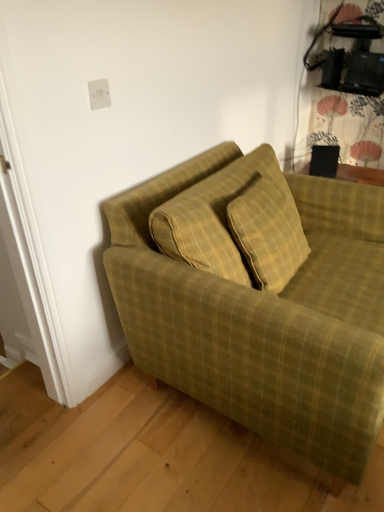
Question: Can you confirm if white plastic outlet at upper center is taller than green plaid fabric couch at lower right?

Choices:
 (A) no
 (B) yes

Answer: (A)

Question: Is white plastic outlet at upper center facing towards green plaid fabric couch at lower right?

Choices:
 (A) no
 (B) yes

Answer: (A)

Question: From a real-world perspective, is white plastic outlet at upper center positioned under green plaid fabric couch at lower right based on gravity?

Choices:
 (A) yes
 (B) no

Answer: (B)

Question: Considering the relative sizes of white plastic outlet at upper center and green plaid fabric couch at lower right in the image provided, is white plastic outlet at upper center shorter than green plaid fabric couch at lower right?

Choices:
 (A) no
 (B) yes

Answer: (B)

Question: Does white plastic outlet at upper center appear on the right side of green plaid fabric couch at lower right?

Choices:
 (A) no
 (B) yes

Answer: (A)

Question: Is white plastic outlet at upper center oriented away from green plaid fabric couch at lower right?

Choices:
 (A) yes
 (B) no

Answer: (B)

Question: Considering the relative sizes of green plaid fabric couch at lower right and white plastic outlet at upper center in the image provided, is green plaid fabric couch at lower right bigger than white plastic outlet at upper center?

Choices:
 (A) yes
 (B) no

Answer: (A)

Question: Would you consider green plaid fabric couch at lower right to be distant from white plastic outlet at upper center?

Choices:
 (A) yes
 (B) no

Answer: (B)

Question: Does green plaid fabric couch at lower right come in front of white plastic outlet at upper center?

Choices:
 (A) no
 (B) yes

Answer: (B)

Question: From a real-world perspective, does green plaid fabric couch at lower right stand above white plastic outlet at upper center?

Choices:
 (A) no
 (B) yes

Answer: (A)

Question: Is green plaid fabric couch at lower right taller than white plastic outlet at upper center?

Choices:
 (A) no
 (B) yes

Answer: (B)

Question: Can white plastic outlet at upper center be found inside green plaid fabric couch at lower right?

Choices:
 (A) no
 (B) yes

Answer: (A)

Question: From the image's perspective, is white plastic outlet at upper center above or below green plaid fabric couch at lower right?

Choices:
 (A) below
 (B) above

Answer: (B)